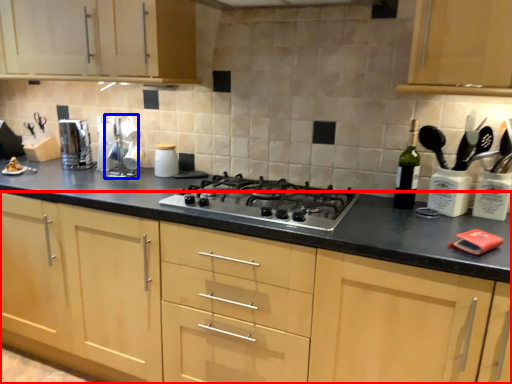
Question: Which object appears farthest to the camera in this image, cabinetry (highlighted by a red box) or appliance (highlighted by a blue box)?

Choices:
 (A) cabinetry
 (B) appliance

Answer: (B)